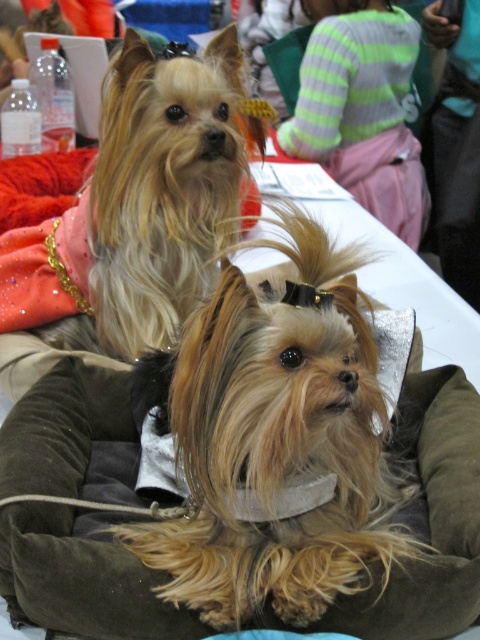
Can you confirm if shiny golden fur at center is smaller than shiny blonde fur at center?

Correct, shiny golden fur at center occupies less space than shiny blonde fur at center.

Measure the distance between shiny golden fur at center and shiny blonde fur at center.

The distance of shiny golden fur at center from shiny blonde fur at center is 20.09 inches.

Identify the location of shiny golden fur at center. The height and width of the screenshot is (640, 480). (276, 445).

I want to click on shiny golden fur at center, so click(276, 445).

Can you confirm if shiny blonde fur at center is shorter than brown suede dog bed at center?

Incorrect, shiny blonde fur at center's height does not fall short of brown suede dog bed at center's.

Does point (130, 307) lie behind point (121, 420)?

Yes, it is.

In order to click on shiny blonde fur at center in this screenshot , I will do `click(134, 216)`.

Is shiny golden fur at center taller than brown suede dog bed at center?

Correct, shiny golden fur at center is much taller as brown suede dog bed at center.

Who is shorter, shiny golden fur at center or brown suede dog bed at center?

brown suede dog bed at center is shorter.

The image size is (480, 640). What are the coordinates of `shiny golden fur at center` in the screenshot? It's located at (276, 445).

Where is `shiny golden fur at center`? Image resolution: width=480 pixels, height=640 pixels. shiny golden fur at center is located at coordinates (276, 445).